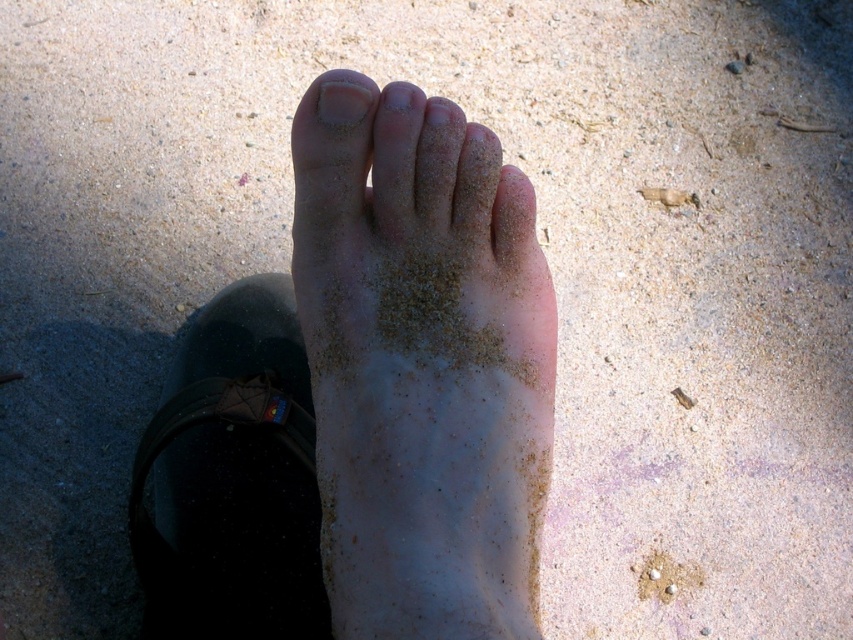
Question: Does matte black sandal at lower left appear on the right side of white sandy footprint at lower center?

Choices:
 (A) yes
 (B) no

Answer: (B)

Question: Which object is positioned farthest from the pale skin foot at center?

Choices:
 (A) white sandy footprint at lower center
 (B) matte black sandal at lower left

Answer: (A)

Question: Which object is positioned farthest from the white matte nail at upper center?

Choices:
 (A) matte black sandal at lower left
 (B) pale skin foot at center

Answer: (A)

Question: Which point is closer to the camera?

Choices:
 (A) pale skin foot at center
 (B) white sandy footprint at lower center
 (C) matte black sandal at lower left

Answer: (A)

Question: Is white sandy footprint at lower center thinner than white matte nail at upper center?

Choices:
 (A) yes
 (B) no

Answer: (B)

Question: Is white sandy footprint at lower center smaller than white matte nail at upper center?

Choices:
 (A) yes
 (B) no

Answer: (B)